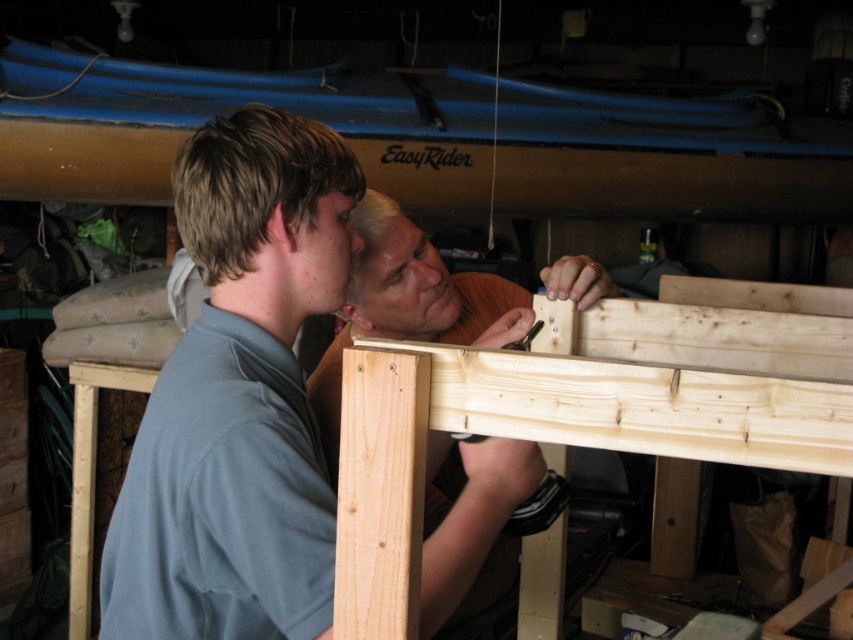
You are a photographer standing in the workshop. You need to capture a photo that includes both the light blue shirt at center and the natural wood plank at center. Based on their positions, which object should you ensure is in the foreground of your photo?

The light blue shirt at center is located above the natural wood plank at center, so to include both in the photo, the natural wood plank at center should be in the foreground since it is lower and closer to the camera.

You are a photographer positioned at the entrance of the workshop. You need to take a photo of the natural wood plank at center without including the light blue shirt at center in the frame. Is this possible given their positions?

The light blue shirt at center is to the left of the natural wood plank at center, so if you position yourself to the right side of the workshop and aim the camera towards the plank, you can capture the natural wood plank at center without including the light blue shirt at center in the frame.

You are a robot with a 6.5 inch wide arm. You need to place an object between the light blue shirt at center and the natural wood plank at center. Can your arm fit in the space between them?

The space between the light blue shirt at center and the natural wood plank at center is 7.14 inches. Since your arm is 6.5 inches wide, it can fit in the space between them.